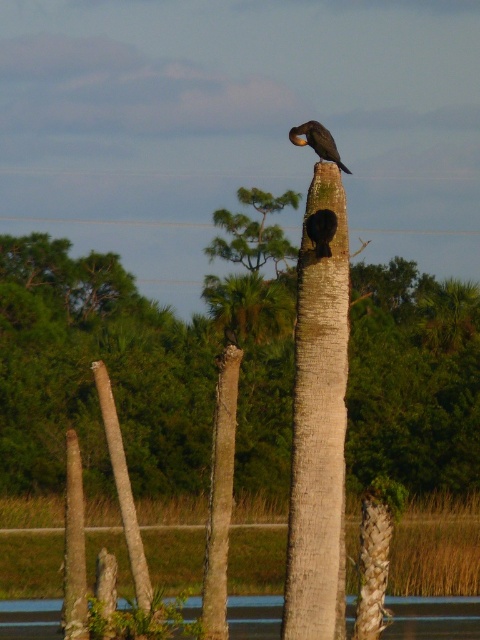
You are a photographer aiming to capture the black matte bird at center without the transparent glass water at center overlapping it. Can you adjust your camera angle to achieve this?

The transparent glass water at center might be wider than black matte bird at center, so adjusting the camera angle could help avoid overlap by positioning the bird outside the wider area of the water.

You are a birdwatcher observing the scene. You notice the brown rough tree trunk at center and the black matte bird at center. Which object is located to the right side?

The black matte bird at center is located to the right side of the brown rough tree trunk at center.

You are a photographer aiming to capture a clear photo of the shiny black bird at center without the transparent glass water at center obstructing the view. Is this possible given their positions?

The shiny black bird at center is behind the transparent glass water at center, so it is possible to capture a clear photo of the shiny black bird at center without obstruction by focusing through the transparent glass water at center.